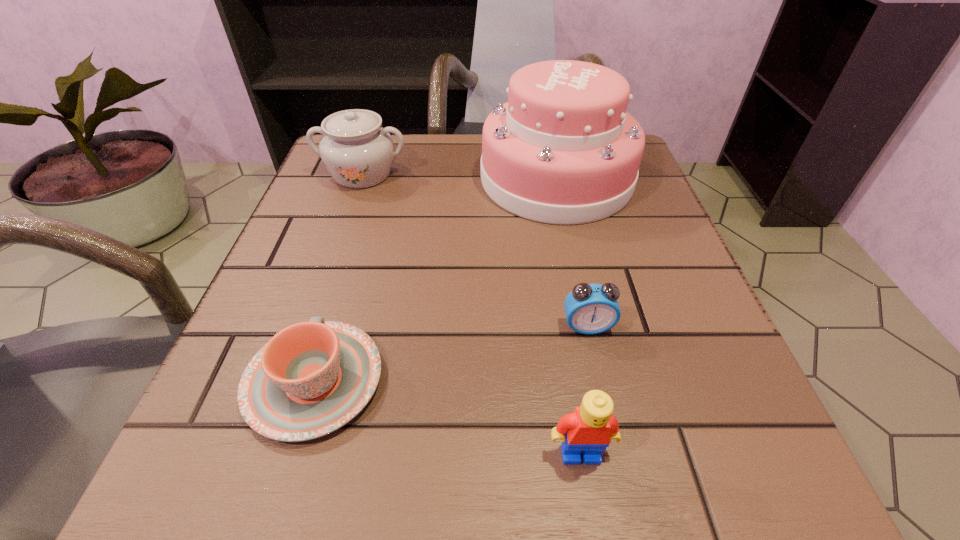
The height and width of the screenshot is (540, 960). In order to click on cake in this screenshot , I will do `click(563, 150)`.

At what (x,y) coordinates should I click in order to perform the action: click on the farther chinaware. Please return your answer as a coordinate pair (x, y). The height and width of the screenshot is (540, 960). Looking at the image, I should click on (358, 152).

Identify the location of Lego. This screenshot has width=960, height=540. (590, 428).

The width and height of the screenshot is (960, 540). In order to click on alarm clock in this screenshot , I will do `click(590, 309)`.

Where is `the nearer chinaware`? the nearer chinaware is located at coordinates (312, 378).

Where is `the shortest object`? This screenshot has height=540, width=960. the shortest object is located at coordinates (312, 378).

Locate an element on the screen. Image resolution: width=960 pixels, height=540 pixels. free location located 0.350m on the front of the tallest object is located at coordinates (606, 402).

The height and width of the screenshot is (540, 960). Identify the location of free space located 0.070m on the back of the farther chinaware. point(374,140).

The image size is (960, 540). Identify the location of free space located on the face of the alarm clock. (602, 393).

At what (x,y) coordinates should I click in order to perform the action: click on vacant space located 0.290m on the handle side of the shortest object. Please return your answer as a coordinate pair (x, y). The height and width of the screenshot is (540, 960). Looking at the image, I should click on (368, 207).